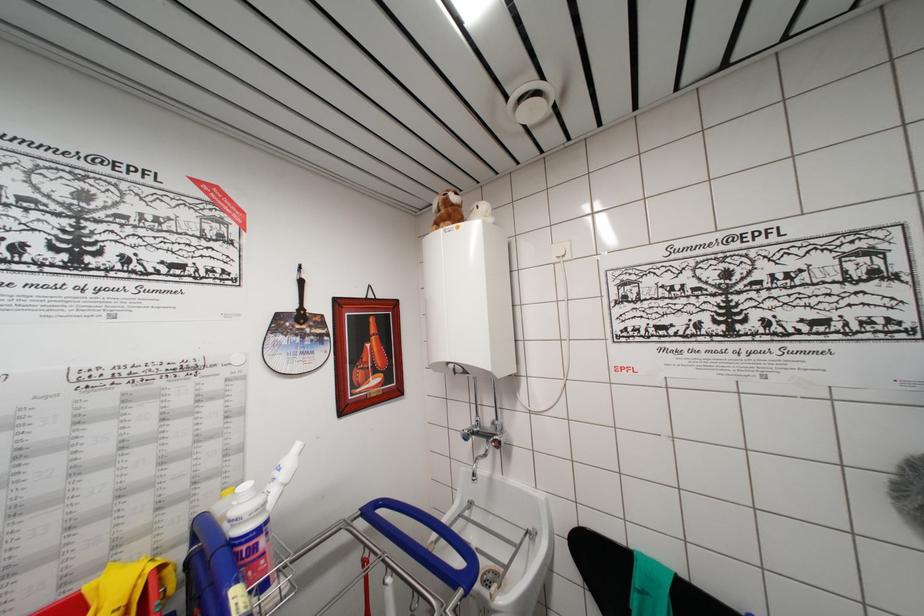
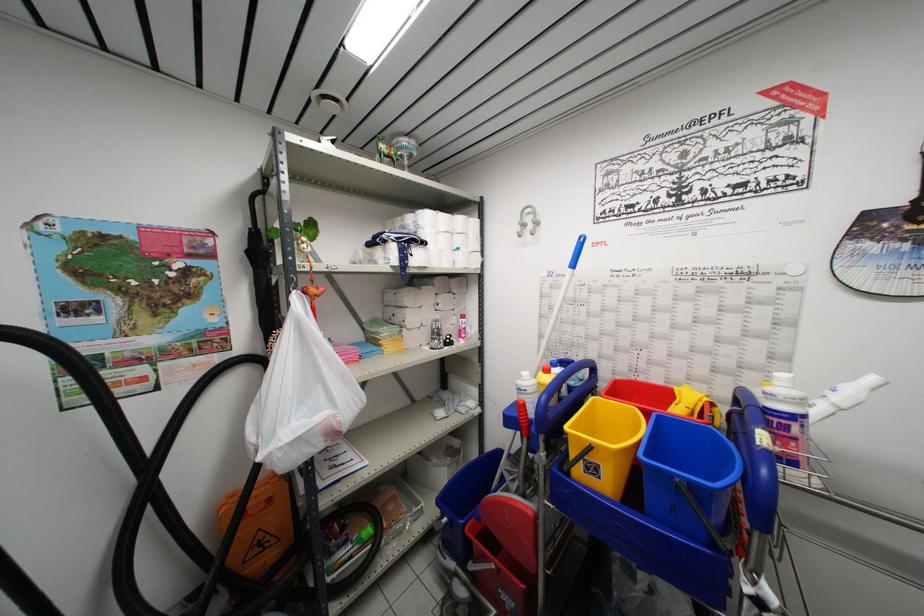
Question: The camera is either moving clockwise (left) or counter-clockwise (right) around the object. The first image is from the beginning of the video and the second image is from the end. Is the camera moving left or right when shooting the video?

Choices:
 (A) Left
 (B) Right

Answer: (B)